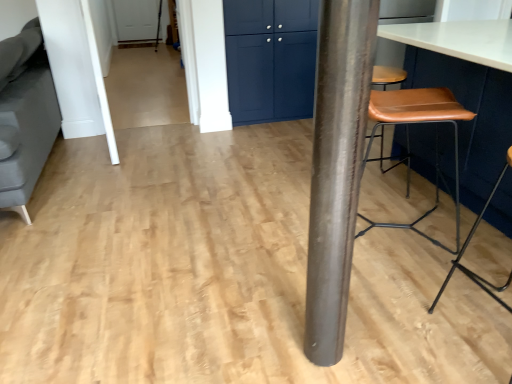
Find the location of `free space to the back side of shiny metallic pole at center`. free space to the back side of shiny metallic pole at center is located at coordinates (302, 311).